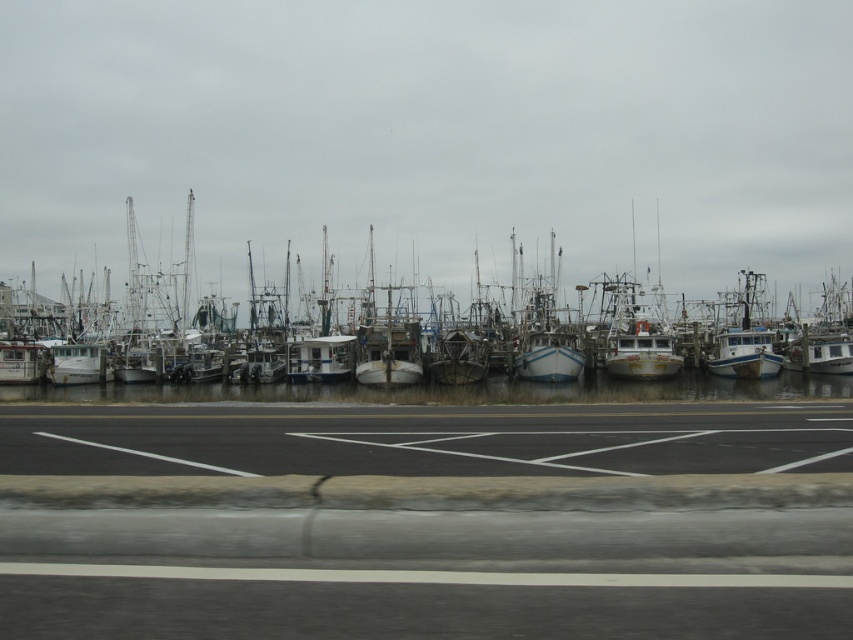
You are a delivery driver who needs to park your truck on the black asphalt parking lot at center. The parking spot is marked at coordinates 0.816, 0.502. Can you confirm if the parking lot is in the center of the image?

The black asphalt parking lot at center is located at coordinates (427,522), which is indeed the center of the image.